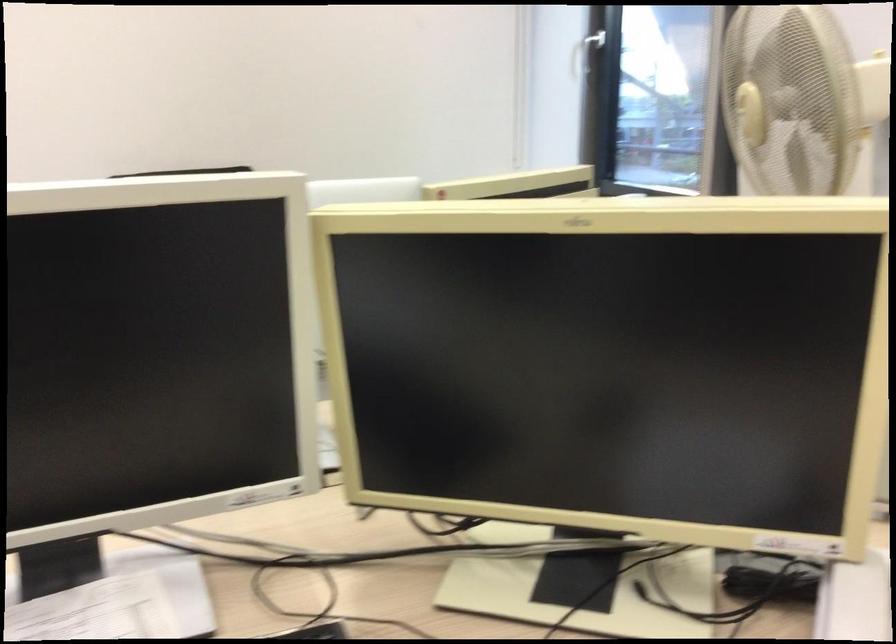
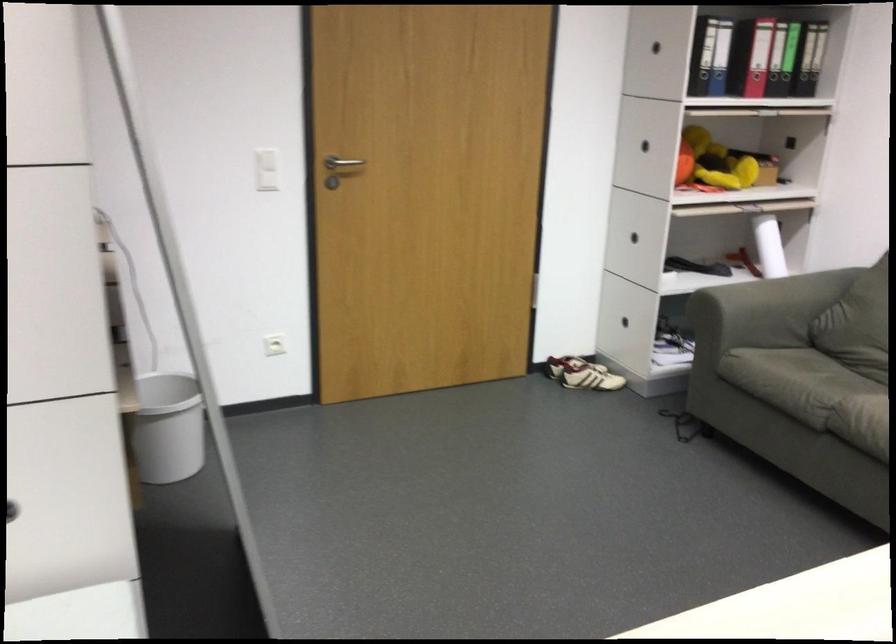
In the scene shown: The first image is from the beginning of the video and the second image is from the end. How did the camera likely rotate when shooting the video?

The camera rotated toward left-down.